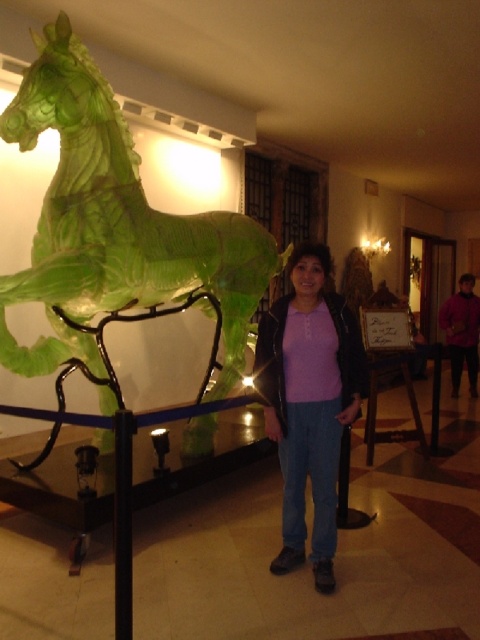
Question: Can you confirm if green glass horse at left is bigger than matte purple sweater at center?

Choices:
 (A) yes
 (B) no

Answer: (A)

Question: Among these points, which one is nearest to the camera?

Choices:
 (A) (444, 328)
 (B) (357, 358)
 (C) (82, 99)

Answer: (B)

Question: Does matte purple sweater at center have a larger size compared to purple sweater at center?

Choices:
 (A) yes
 (B) no

Answer: (B)

Question: Is green glass horse at left smaller than purple sweater at center?

Choices:
 (A) no
 (B) yes

Answer: (A)

Question: Which point appears farthest from the camera in this image?

Choices:
 (A) (458, 344)
 (B) (286, 472)
 (C) (106, 109)

Answer: (A)

Question: Which of the following is the farthest from the observer?

Choices:
 (A) green glass horse at left
 (B) purple sweater at center

Answer: (B)